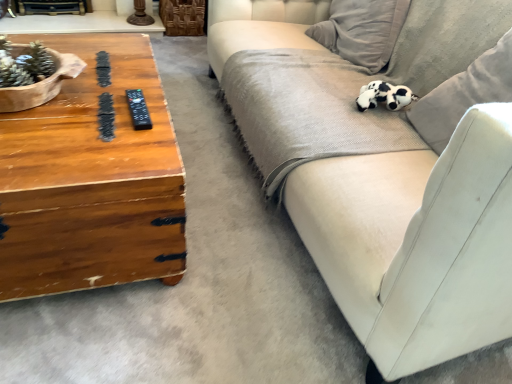
Question: Is black plastic remote at left far away from velvet beige couch at right?

Choices:
 (A) yes
 (B) no

Answer: (B)

Question: Is black plastic remote at left not inside velvet beige couch at right?

Choices:
 (A) yes
 (B) no

Answer: (A)

Question: Does black plastic remote at left have a larger size compared to velvet beige couch at right?

Choices:
 (A) yes
 (B) no

Answer: (B)

Question: Is black plastic remote at left in front of velvet beige couch at right?

Choices:
 (A) yes
 (B) no

Answer: (B)

Question: From a real-world perspective, is black plastic remote at left below velvet beige couch at right?

Choices:
 (A) no
 (B) yes

Answer: (A)

Question: From a real-world perspective, is woodenmaterial/texturecoffee table at left positioned above or below black plastic remote at left?

Choices:
 (A) below
 (B) above

Answer: (A)

Question: From the image's perspective, relative to black plastic remote at left, is woodenmaterial/texturecoffee table at left above or below?

Choices:
 (A) above
 (B) below

Answer: (B)

Question: Is woodenmaterial/texturecoffee table at left in front of or behind black plastic remote at left in the image?

Choices:
 (A) behind
 (B) front

Answer: (B)

Question: Considering the positions of woodenmaterial/texturecoffee table at left and black plastic remote at left in the image, is woodenmaterial/texturecoffee table at left taller or shorter than black plastic remote at left?

Choices:
 (A) tall
 (B) short

Answer: (A)

Question: Considering the positions of black plastic remote at left and woodenmaterial/texturecoffee table at left in the image, is black plastic remote at left taller or shorter than woodenmaterial/texturecoffee table at left?

Choices:
 (A) short
 (B) tall

Answer: (A)

Question: Looking at their shapes, would you say black plastic remote at left is wider or thinner than woodenmaterial/texturecoffee table at left?

Choices:
 (A) thin
 (B) wide

Answer: (A)

Question: Is black plastic remote at left to the left or to the right of woodenmaterial/texturecoffee table at left in the image?

Choices:
 (A) right
 (B) left

Answer: (A)

Question: Choose the correct answer: Is black plastic remote at left inside woodenmaterial/texturecoffee table at left or outside it?

Choices:
 (A) inside
 (B) outside

Answer: (A)

Question: Considering the positions of black and white plush toy at upper right and woodenmaterial/texturecoffee table at left in the image, is black and white plush toy at upper right wider or thinner than woodenmaterial/texturecoffee table at left?

Choices:
 (A) thin
 (B) wide

Answer: (A)

Question: Considering the positions of black and white plush toy at upper right and woodenmaterial/texturecoffee table at left in the image, is black and white plush toy at upper right taller or shorter than woodenmaterial/texturecoffee table at left?

Choices:
 (A) short
 (B) tall

Answer: (A)